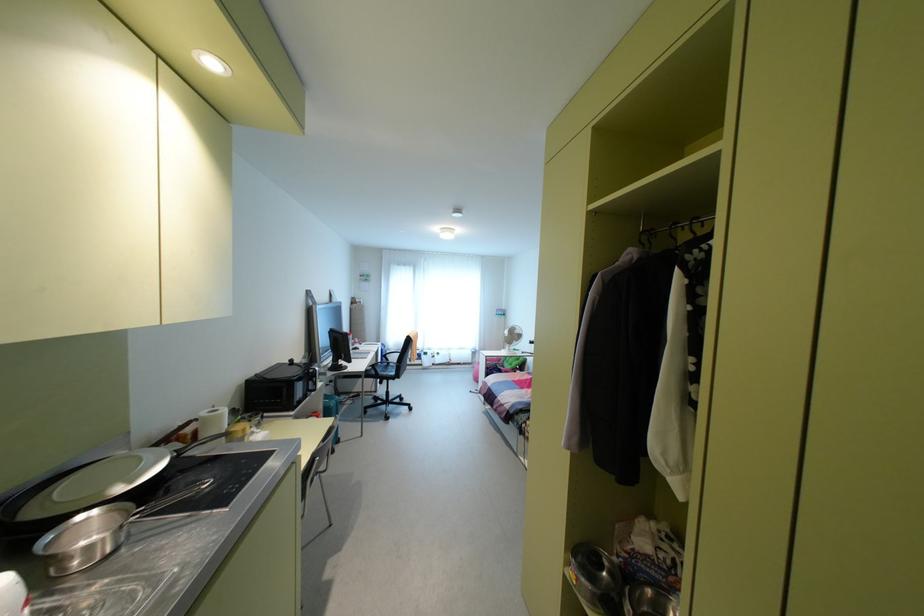
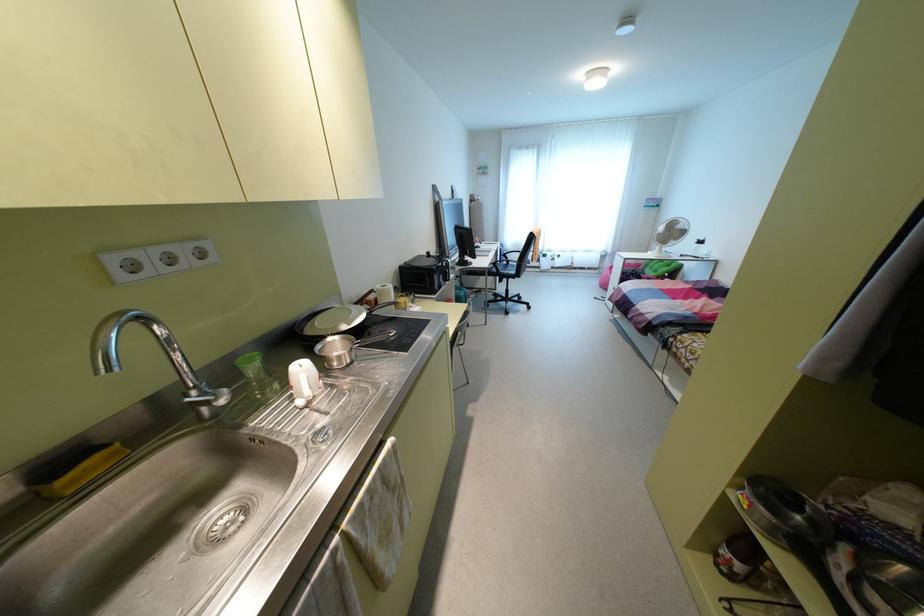
The first image is from the beginning of the video and the second image is from the end. How did the camera likely rotate when shooting the video?

The camera rotated toward left-down.